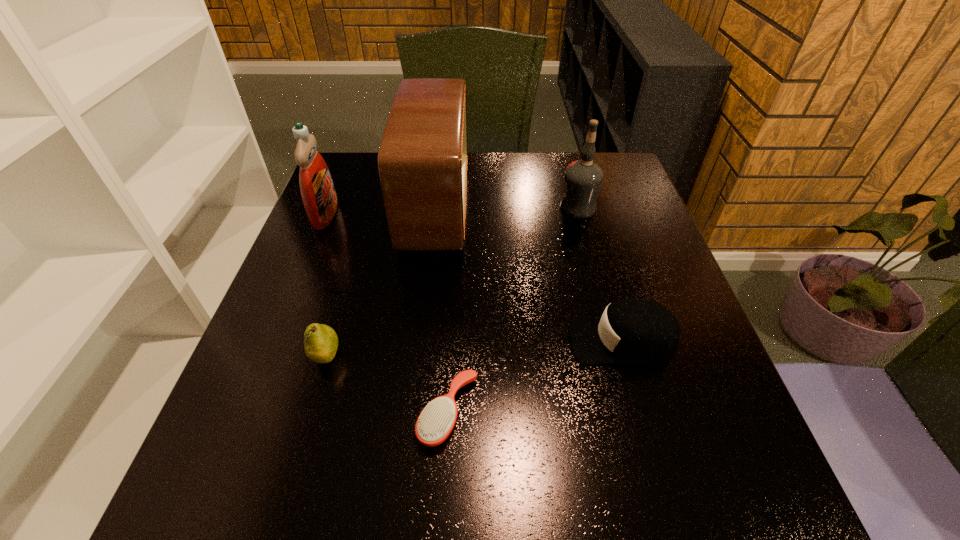
The height and width of the screenshot is (540, 960). Find the location of `pear located in the left edge section of the desktop`. pear located in the left edge section of the desktop is located at coordinates (321, 342).

This screenshot has width=960, height=540. What are the coordinates of `vodka located at the right edge` in the screenshot? It's located at (583, 178).

Find the location of a particular element. cap that is positioned at the right edge is located at coordinates (631, 331).

At what (x,y) coordinates should I click in order to perform the action: click on object that is at the far right corner. Please return your answer as a coordinate pair (x, y). Looking at the image, I should click on (583, 178).

Where is `vacant space at the far edge`? vacant space at the far edge is located at coordinates (523, 196).

At what (x,y) coordinates should I click in order to perform the action: click on free space at the near edge of the desktop. Please return your answer as a coordinate pair (x, y). The width and height of the screenshot is (960, 540). Looking at the image, I should click on (416, 523).

This screenshot has height=540, width=960. What are the coordinates of `vacant point at the left edge` in the screenshot? It's located at (255, 357).

Locate an element on the screen. vacant region at the right edge of the desktop is located at coordinates (634, 204).

You are a GUI agent. You are given a task and a screenshot of the screen. Output one action in this format:
    pyautogui.click(x=<x>, y=<y>)
    Task: Click on the vacant space at the far left corner of the desktop
    The height and width of the screenshot is (540, 960).
    Given the screenshot: What is the action you would take?
    pyautogui.click(x=337, y=174)

This screenshot has width=960, height=540. In the image, there is a desktop. What are the coordinates of `vacant space at the far right corner` in the screenshot? It's located at (635, 184).